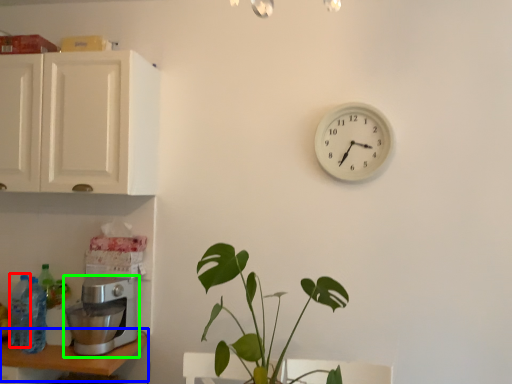
Question: Based on their relative distances, which object is farther from bottle (highlighted by a red box)? Choose from table (highlighted by a blue box) and coffee maker (highlighted by a green box).

Choices:
 (A) table
 (B) coffee maker

Answer: (B)